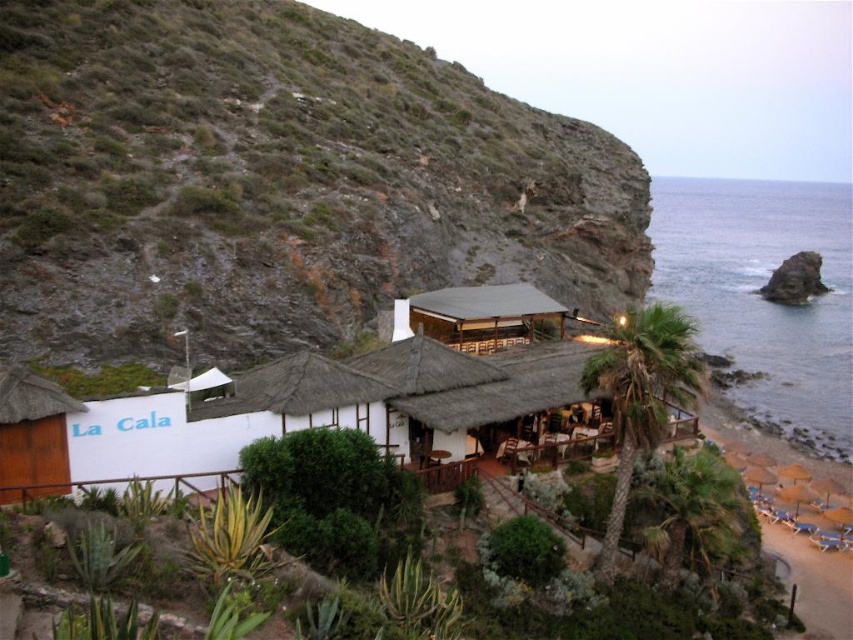
Question: Which of these objects is positioned farthest from the blue water at right?

Choices:
 (A) rocky cliff at upper left
 (B) wooden thatched hut at center
 (C) white thatched roof at center

Answer: (C)

Question: Can you confirm if white thatched roof at center is positioned above blue water at right?

Choices:
 (A) yes
 (B) no

Answer: (B)

Question: Is blue water at right positioned at the back of wooden thatched hut at center?

Choices:
 (A) no
 (B) yes

Answer: (B)

Question: Based on their relative distances, which object is farther from the white thatched roof at center?

Choices:
 (A) wooden thatched hut at center
 (B) blue water at right

Answer: (B)

Question: Which point is farther to the camera?

Choices:
 (A) (312, 332)
 (B) (740, 412)
 (C) (352, 371)

Answer: (B)

Question: Does rocky cliff at upper left appear over blue water at right?

Choices:
 (A) yes
 (B) no

Answer: (B)